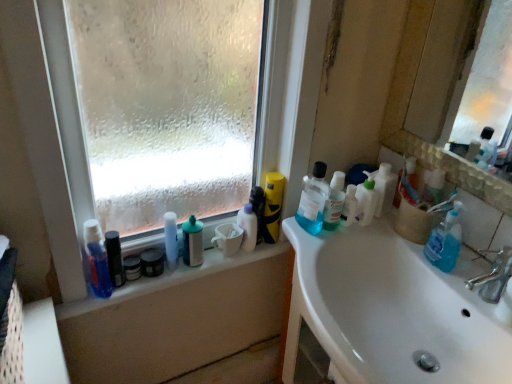
Question: Considering the relative positions of matte black jar at window sill, the seventh toiletry viewed from the right, and white plastic bottle at upper right, the 3th cleaning product viewed from the left, in the image provided, is matte black jar at window sill, the seventh toiletry viewed from the right, to the left or to the right of white plastic bottle at upper right, the 3th cleaning product viewed from the left,?

Choices:
 (A) left
 (B) right

Answer: (A)

Question: From a real-world perspective, is matte black jar at window sill, which appears as the 2th toiletry when viewed from the left, physically located above or below white plastic bottle at upper right, the 3th cleaning product viewed from the left?

Choices:
 (A) above
 (B) below

Answer: (B)

Question: Based on their relative distances, which object is farther from the white glossy bottle at center, placed as the sixth toiletry when sorted from right to left?

Choices:
 (A) blue translucent mouthwash at center, arranged as the 2th toiletry when viewed from the right
 (B) clear plastic window sill at upper left
 (C) silver metallic faucet at sink right
 (D) white pump bottle at upper right, acting as the 2th cleaning product starting from the right
 (E) translucent plastic toothbrush at upper right, which is counted as the 8th toiletry, starting from the left

Answer: (C)

Question: Considering the real-world distances, which object is farthest from the silver metallic faucet at sink right?

Choices:
 (A) blue glossy lotion at left, which is the 8th toiletry in right-to-left order
 (B) translucent plastic toothbrush at upper right, which is counted as the 1th toiletry, starting from the right
 (C) frosted glass window at upper left
 (D) matte plastic spray can at window, which is counted as the 4th toiletry, starting from the left
 (E) white glossy sink at lower right

Answer: (A)